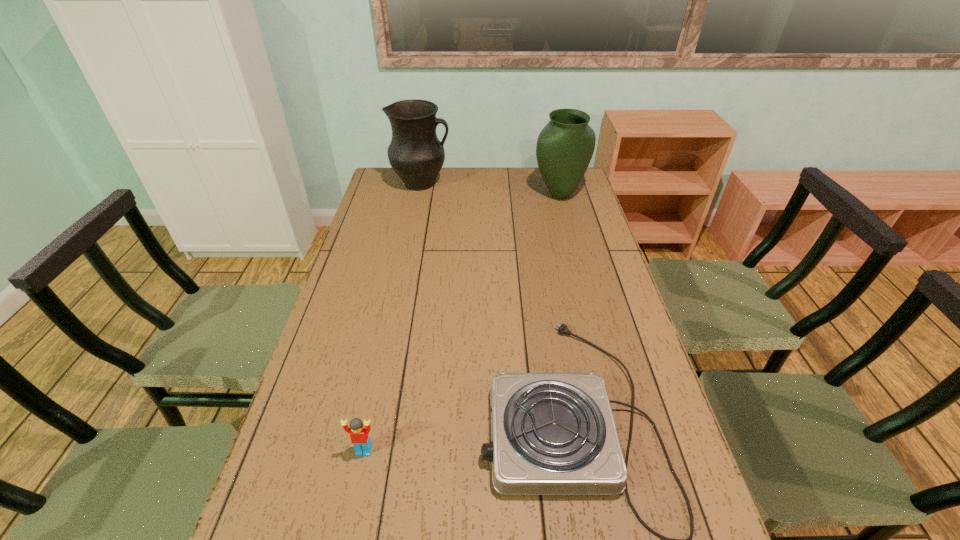
At what (x,y) coordinates should I click in order to perform the action: click on object that is at the right edge. Please return your answer as a coordinate pair (x, y). Looking at the image, I should click on (565, 146).

Locate an element on the screen. object that is positioned at the far left corner is located at coordinates (415, 153).

Where is `object at the far right corner`? The width and height of the screenshot is (960, 540). object at the far right corner is located at coordinates (565, 146).

The height and width of the screenshot is (540, 960). In order to click on free space at the far edge of the desktop in this screenshot , I will do `click(469, 174)`.

Locate an element on the screen. vacant space at the left edge of the desktop is located at coordinates (372, 267).

Where is `blank space at the right edge of the desktop`? This screenshot has width=960, height=540. blank space at the right edge of the desktop is located at coordinates (582, 195).

Find the location of a particular element. vacant area that lies between the pitcher and the third tallest object is located at coordinates (393, 317).

You are a GUI agent. You are given a task and a screenshot of the screen. Output one action in this format:
    pyautogui.click(x=<x>, y=<y>)
    Task: Click on the vacant region between the vase and the second shortest object
    The image size is (960, 540).
    Given the screenshot: What is the action you would take?
    pyautogui.click(x=462, y=322)

Where is `empty space that is in between the Lego and the vase`? empty space that is in between the Lego and the vase is located at coordinates (462, 322).

This screenshot has width=960, height=540. In order to click on vacant space in between the vase and the Lego in this screenshot , I will do `click(462, 322)`.